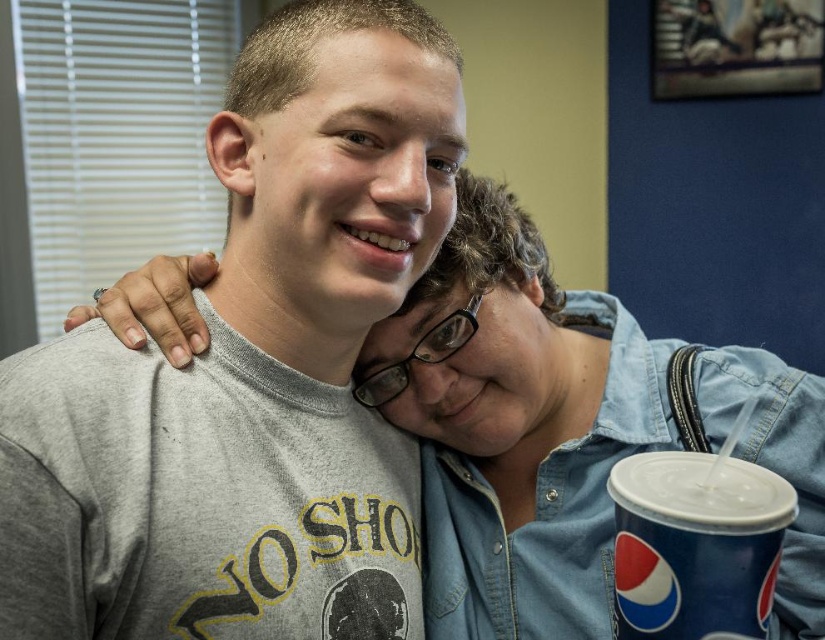
Question: Is denim jacket at center to the left of blue paper cup at lower right from the viewer's perspective?

Choices:
 (A) no
 (B) yes

Answer: (B)

Question: Among these objects, which one is farthest from the camera?

Choices:
 (A) gray matte t-shirt at upper left
 (B) denim jacket at center
 (C) blue paper cup at lower right

Answer: (B)

Question: Is the position of gray matte t-shirt at upper left more distant than that of blue paper cup at lower right?

Choices:
 (A) no
 (B) yes

Answer: (B)

Question: Is gray matte t-shirt at upper left wider than denim jacket at center?

Choices:
 (A) yes
 (B) no

Answer: (B)

Question: Which point is closer to the camera?

Choices:
 (A) blue paper cup at lower right
 (B) denim jacket at center
 (C) gray matte t-shirt at upper left

Answer: (A)

Question: Which point is farther from the camera taking this photo?

Choices:
 (A) (647, 492)
 (B) (389, 273)

Answer: (B)